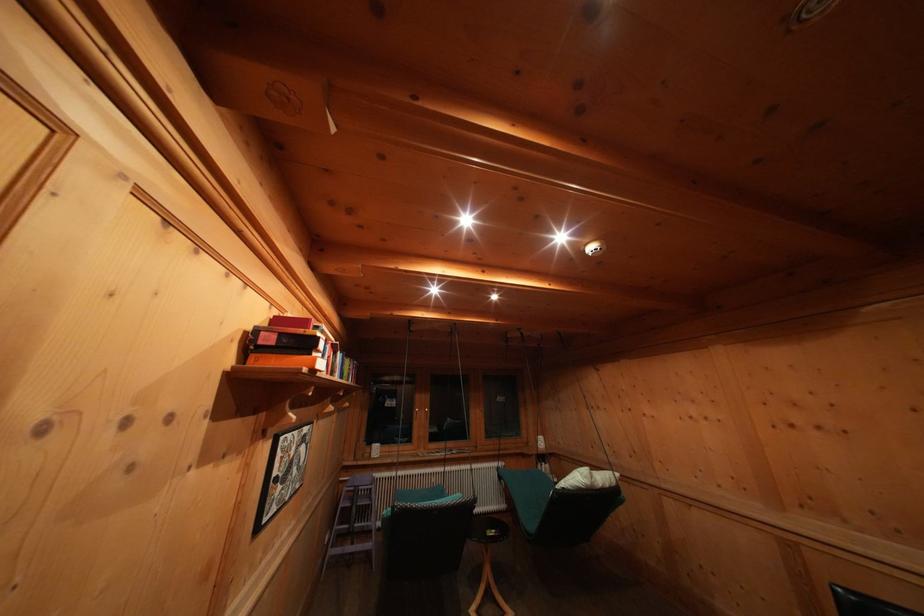
The image size is (924, 616). What are the coordinates of `white candle holder` in the screenshot? It's located at (381, 464).